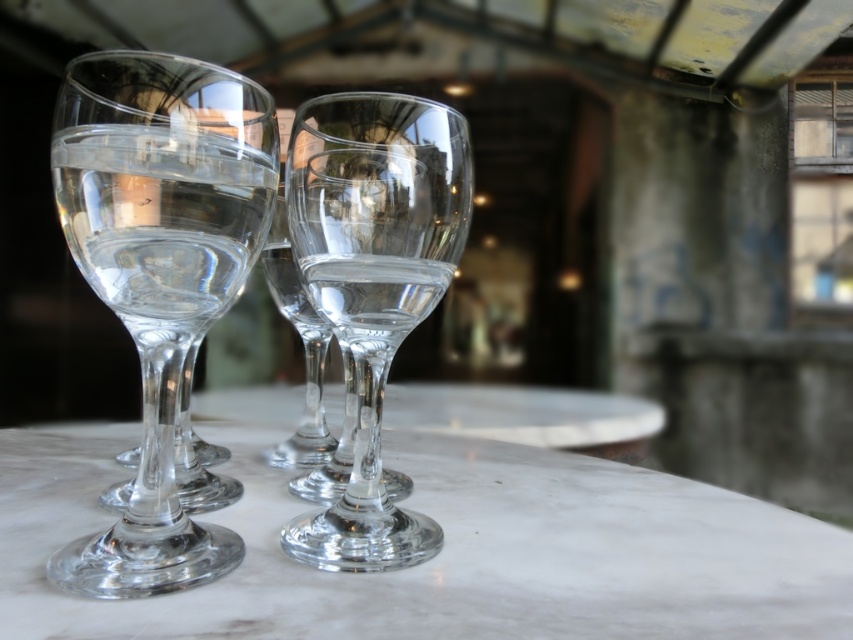
Question: Among these points, which one is nearest to the camera?

Choices:
 (A) (426, 504)
 (B) (303, 218)
 (C) (120, 550)

Answer: (C)

Question: Does transparent glass table at center appear over transparent glass wine glass at left?

Choices:
 (A) yes
 (B) no

Answer: (B)

Question: Considering the relative positions of transparent glass table at center and transparent glass wine glass at center in the image provided, where is transparent glass table at center located with respect to transparent glass wine glass at center?

Choices:
 (A) below
 (B) above

Answer: (A)

Question: Which of the following is the closest to the observer?

Choices:
 (A) transparent glass table at center
 (B) transparent glass wine glass at center

Answer: (A)

Question: Which object is the farthest from the transparent glass wine glass at center?

Choices:
 (A) transparent glass wine glass at left
 (B) transparent glass table at center

Answer: (B)

Question: Can you confirm if transparent glass wine glass at left is positioned below transparent glass wine glass at center?

Choices:
 (A) yes
 (B) no

Answer: (B)